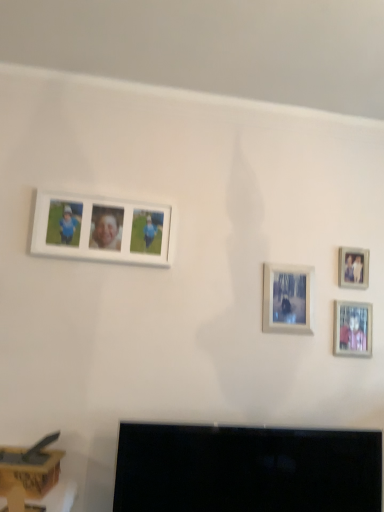
Question: Does matte silver photo frame at lower right, which is the 3th picture frame in left-to-right order, lie behind black glossy tv at lower center?

Choices:
 (A) no
 (B) yes

Answer: (B)

Question: Is matte silver photo frame at lower right, which is counted as the second picture frame, starting from the right, thinner than black glossy tv at lower center?

Choices:
 (A) no
 (B) yes

Answer: (B)

Question: Is matte silver photo frame at lower right, which is the 3th picture frame in left-to-right order, facing towards black glossy tv at lower center?

Choices:
 (A) yes
 (B) no

Answer: (B)

Question: From a real-world perspective, is matte silver photo frame at lower right, which is counted as the second picture frame, starting from the right, physically below black glossy tv at lower center?

Choices:
 (A) no
 (B) yes

Answer: (A)

Question: Can you confirm if matte silver photo frame at lower right, which is counted as the second picture frame, starting from the right, is bigger than black glossy tv at lower center?

Choices:
 (A) no
 (B) yes

Answer: (A)

Question: Relative to matte silver photo frame at lower right, which is the 3th picture frame in left-to-right order, is black glossy tv at lower center in front or behind?

Choices:
 (A) behind
 (B) front

Answer: (B)

Question: From their relative heights in the image, would you say black glossy tv at lower center is taller or shorter than matte silver photo frame at lower right, which is the 3th picture frame in left-to-right order?

Choices:
 (A) short
 (B) tall

Answer: (B)

Question: Considering the positions of black glossy tv at lower center and matte silver photo frame at lower right, which is counted as the second picture frame, starting from the right, in the image, is black glossy tv at lower center bigger or smaller than matte silver photo frame at lower right, which is counted as the second picture frame, starting from the right,?

Choices:
 (A) big
 (B) small

Answer: (A)

Question: Is black glossy tv at lower center to the left or to the right of matte silver photo frame at lower right, which is counted as the second picture frame, starting from the right, in the image?

Choices:
 (A) right
 (B) left

Answer: (B)

Question: Is white matte photo frame at upper left, which ranks as the 1th picture frame in left-to-right order, wider or thinner than matte silver photo frame at lower right, which is counted as the second picture frame, starting from the right?

Choices:
 (A) thin
 (B) wide

Answer: (B)

Question: From their relative heights in the image, would you say white matte photo frame at upper left, placed as the 4th picture frame when sorted from right to left, is taller or shorter than matte silver photo frame at lower right, which is counted as the second picture frame, starting from the right?

Choices:
 (A) short
 (B) tall

Answer: (B)

Question: Does point (127, 209) appear closer or farther from the camera than point (357, 335)?

Choices:
 (A) farther
 (B) closer

Answer: (B)

Question: From the image's perspective, is white matte photo frame at upper left, placed as the 4th picture frame when sorted from right to left, above or below matte silver photo frame at lower right, which is counted as the second picture frame, starting from the right?

Choices:
 (A) below
 (B) above

Answer: (B)

Question: From a real-world perspective, is wooden photo frame at upper right, which appears as the 4th picture frame when viewed from the left, physically located above or below matte silver photo frame at lower right, which is counted as the second picture frame, starting from the right?

Choices:
 (A) above
 (B) below

Answer: (A)

Question: Does point (360, 287) appear closer or farther from the camera than point (370, 355)?

Choices:
 (A) farther
 (B) closer

Answer: (A)